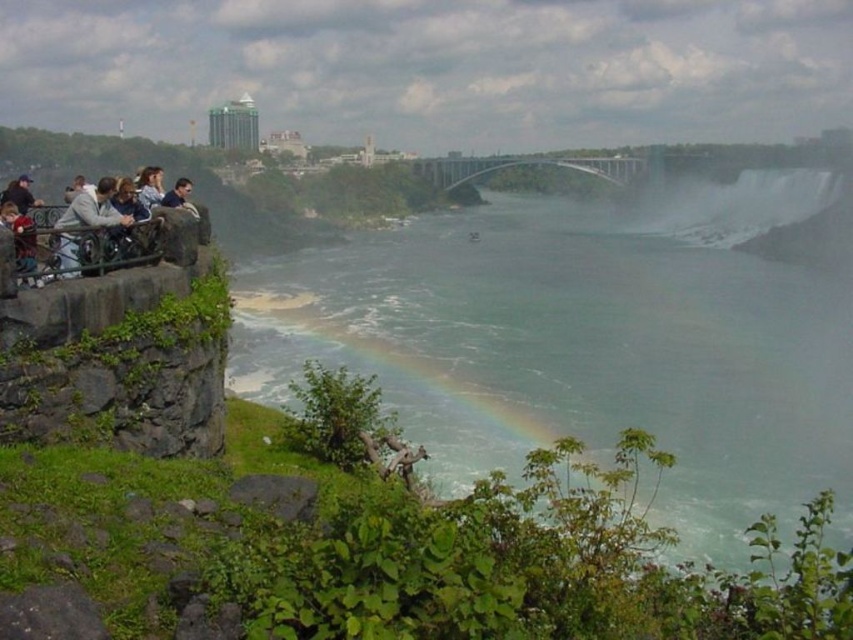
You are standing at the stone wall with a metal railing on the left side of the image. You want to walk to the point marked at coordinate (589, 342). Is that point located on the misty water at center?

Yes, the point marked at coordinate (589, 342) is on the misty water at center, so you can walk towards it but should be cautious as it is over water.

You are a photographer standing at the light gray concrete railing at left, aiming to capture the translucent misty water at center in your shot. Given that your camera has a maximum zoom range of 100 meters, will you be able to focus on the misty water without moving closer?

The distance between the translucent misty water at center and the light gray concrete railing at left is 145.18 meters. Since your camera can only zoom up to 100 meters, you won not be able to focus on the misty water without moving closer.

You are a photographer standing at the edge of the grassy area near the stone wall with a metal railing. You want to capture a photo of the translucent misty water at center while ensuring the light brown leather jacket at left is also in the frame. Can you fit both objects in your camera viewfinder without moving your position?

The translucent misty water at center is bigger than the light brown leather jacket at left, so yes, both can be captured in the camera viewfinder since the misty water is larger and likely occupies more space, allowing the jacket to also be included without moving position.